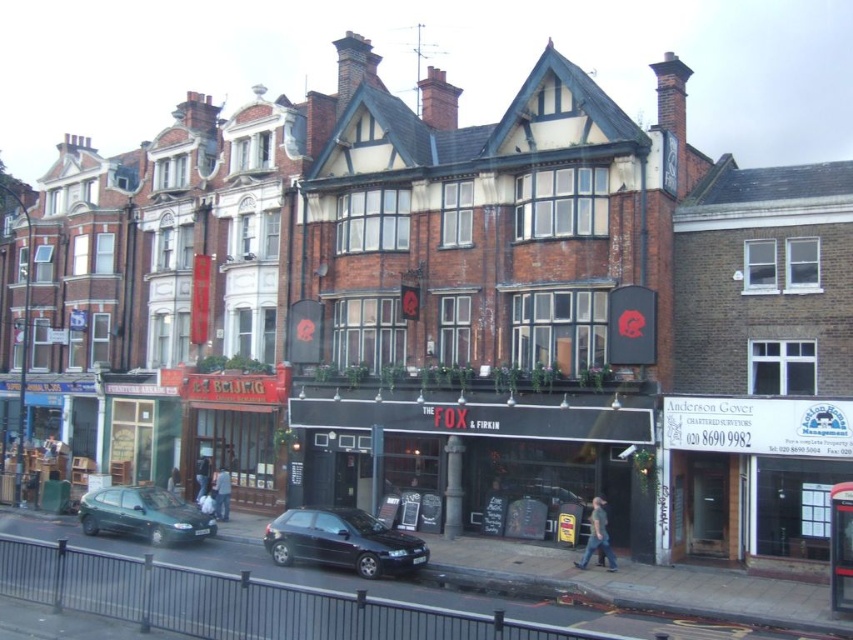
You are a pedestrian standing on the sidewalk in front of the central building. You need to cross the street to reach the bus stop. There are two cars in the scene. Which car, the shiny black car at center or the metallic green hatchback at lower left, is closer to you so you can safely step around it first?

The shiny black car at center is closer to the viewer than the metallic green hatchback at lower left, so you can safely step around it first.

You are a delivery person approaching the entrance of The Fox Firkin. You need to park your shiny black car at center near the black matte signboard at center. Can you safely park the car in front of the signboard without blocking the entrance?

The shiny black car at center is behind black matte signboard at center, so you can safely park the car in front of the signboard without blocking the entrance.

You are a delivery driver who needs to park your truck between the black matte signboard at center and the metallic green hatchback at lower left. Is there enough space for your truck, which is 6 meters long?

The black matte signboard at center is to the right of the metallic green hatchback at lower left, but the distance between them is not provided. Without knowing the exact spacing, it is impossible to determine if the 6 meter truck can fit.